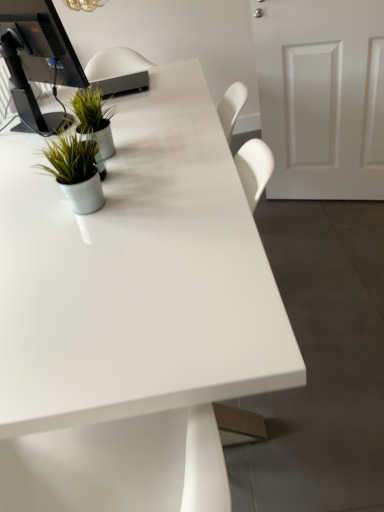
Locate an element on the screen. This screenshot has width=384, height=512. free space to the back side of metallic silver pot at left, which is counted as the first houseplant, starting from the bottom is located at coordinates (105, 168).